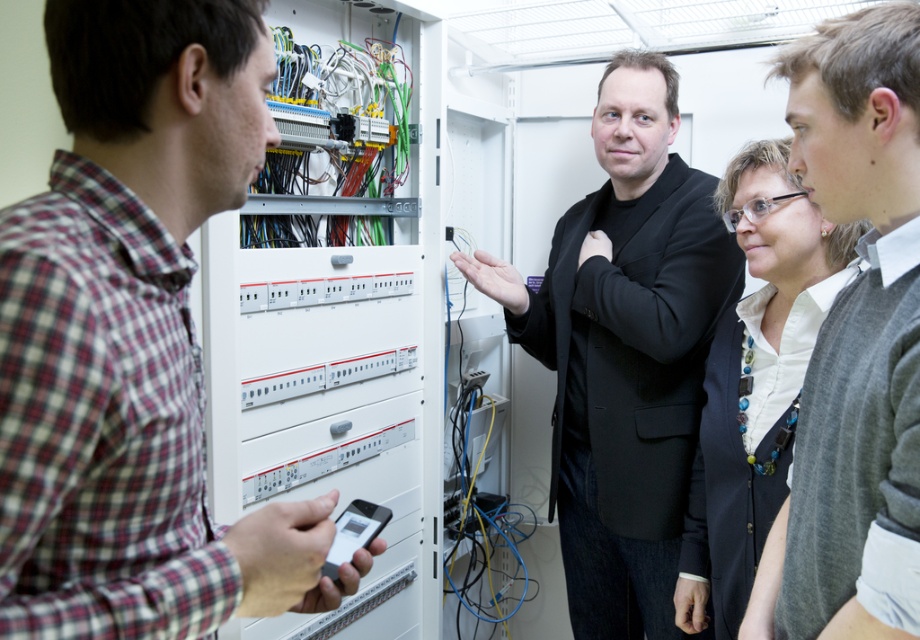
Find the location of `plaid cotton shirt at left`. plaid cotton shirt at left is located at coordinates (134, 339).

Does plaid cotton shirt at left have a smaller size compared to black matte suit at center?

Correct, plaid cotton shirt at left occupies less space than black matte suit at center.

In order to click on plaid cotton shirt at left in this screenshot , I will do `click(134, 339)`.

Who is more distant from viewer, (x=861, y=445) or (x=715, y=449)?

Positioned behind is point (x=715, y=449).

Between gray sweater at center and white glossy shirt at upper center, which one has less height?

gray sweater at center is shorter.

I want to click on gray sweater at center, so click(854, 346).

The image size is (920, 640). I want to click on gray sweater at center, so click(x=854, y=346).

Can you confirm if plaid cotton shirt at left is wider than gray sweater at center?

Yes.

Between point (111, 214) and point (772, 628), which one is positioned in front?

Point (111, 214)

You are a GUI agent. You are given a task and a screenshot of the screen. Output one action in this format:
    pyautogui.click(x=<x>, y=<y>)
    Task: Click on the plaid cotton shirt at left
    This screenshot has height=640, width=920.
    Given the screenshot: What is the action you would take?
    pyautogui.click(x=134, y=339)